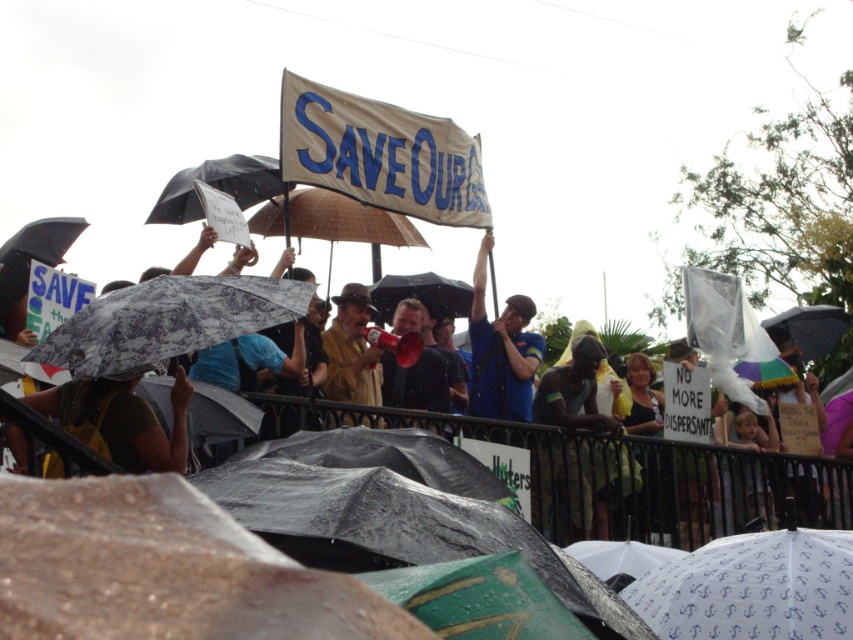
You are a photographer trying to capture the protest scene. You notice the dark skin figure at center and the dark blue shirt at center. Which object is wider in the image?

The dark skin figure at center is wider than the dark blue shirt at center.

You are a photographer trying to capture a clear shot of the blue fabric shirt at center. The transparent plastic umbrella at upper center is blocking your view. Can you estimate if the umbrella can be moved aside without affecting the shirt?

The blue fabric shirt at center is thinner than the transparent plastic umbrella at upper center, so the umbrella is thicker. Moving the umbrella might require more effort, but since the shirt is thinner, it might not obstruct as much. However, the main concern is the umbrella being thicker, so moving it could be challenging but possible depending on space.

Looking at this image, you are a photographer standing at the center of the protest scene. You want to capture a photo of the white printed umbrella at lower right. Based on its coordinates, where should you aim your camera?

The white printed umbrella at lower right is located at coordinates point (752, 588), so you should aim your camera towards the lower right area to capture it.